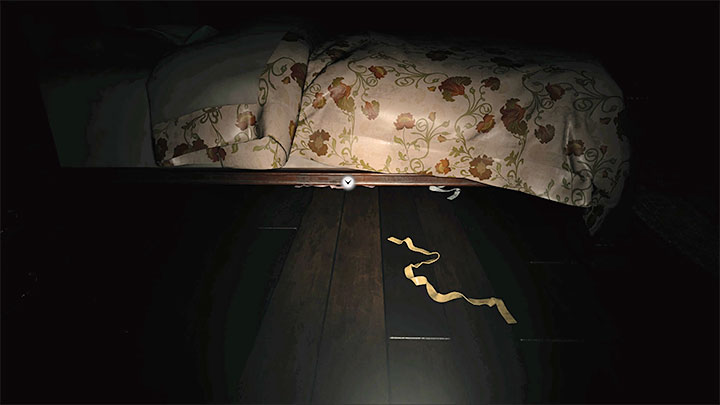
Find the location of a particular element. wood floor is located at coordinates (186, 271), (602, 372).